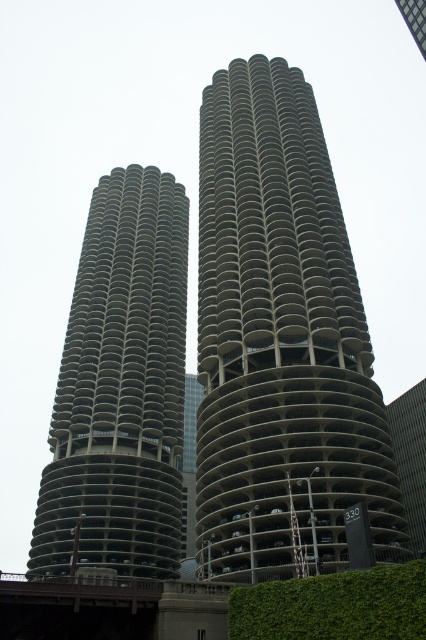
Question: Is gray concrete building at left closer to camera compared to green leafy hedge at lower right?

Choices:
 (A) no
 (B) yes

Answer: (A)

Question: Which point is farther to the camera?

Choices:
 (A) (275, 374)
 (B) (135, 396)
 (C) (354, 604)

Answer: (B)

Question: Which object is the farthest from the gray concrete building at center?

Choices:
 (A) gray concrete building at left
 (B) green leafy hedge at lower right

Answer: (B)

Question: Can you confirm if gray concrete building at left is positioned below green leafy hedge at lower right?

Choices:
 (A) no
 (B) yes

Answer: (A)

Question: Is gray concrete building at center bigger than green leafy hedge at lower right?

Choices:
 (A) yes
 (B) no

Answer: (A)

Question: Which of these objects is positioned farthest from the gray concrete building at left?

Choices:
 (A) green leafy hedge at lower right
 (B) gray concrete building at center

Answer: (A)